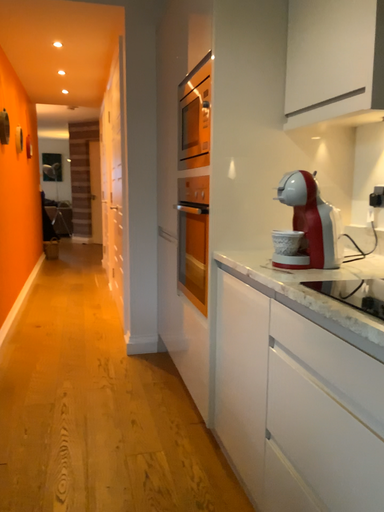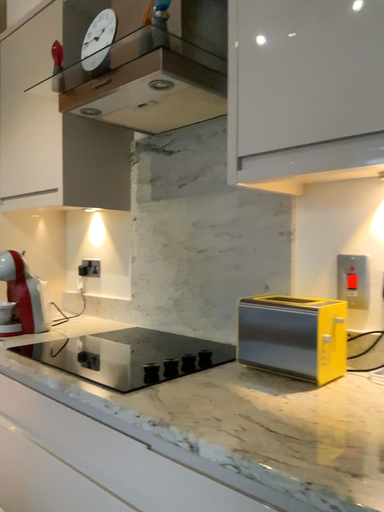
Question: How did the camera likely rotate when shooting the video?

Choices:
 (A) rotated downward
 (B) rotated upward

Answer: (B)